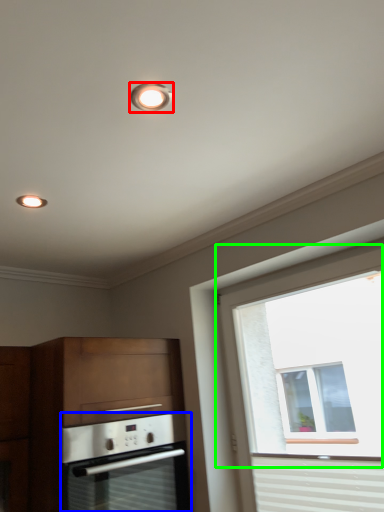
Question: Which is nearer to the lighting (highlighted by a red box)? oven (highlighted by a blue box) or window (highlighted by a green box).

Choices:
 (A) oven
 (B) window

Answer: (A)